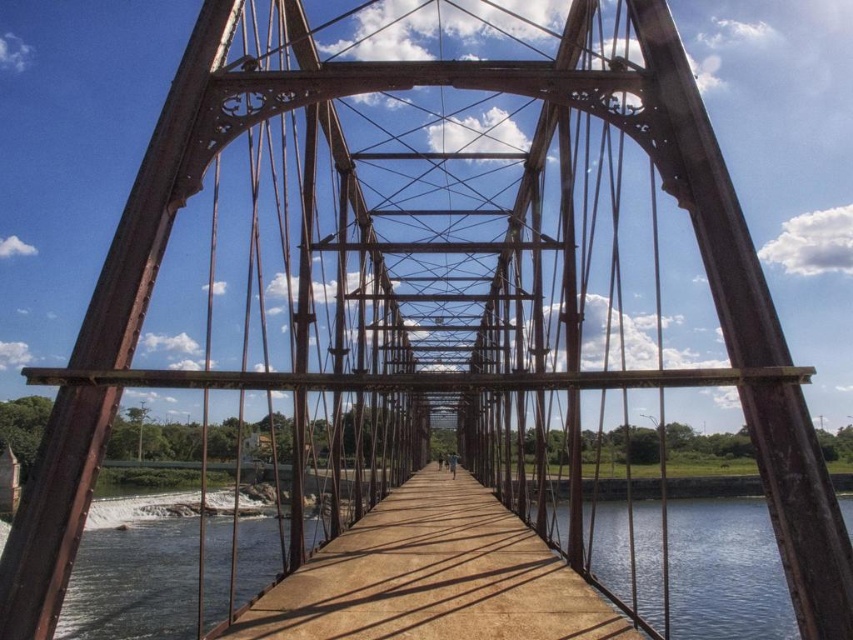
Is point (3, 522) farther from viewer compared to point (375, 636)?

Yes, it is.

Which is in front, point (695, 566) or point (596, 618)?

Point (596, 618) is in front.

Which is in front, point (117, 624) or point (239, 625)?

Point (239, 625) is in front.

Find the location of `smooth concrete river at center`. smooth concrete river at center is located at coordinates (724, 572).